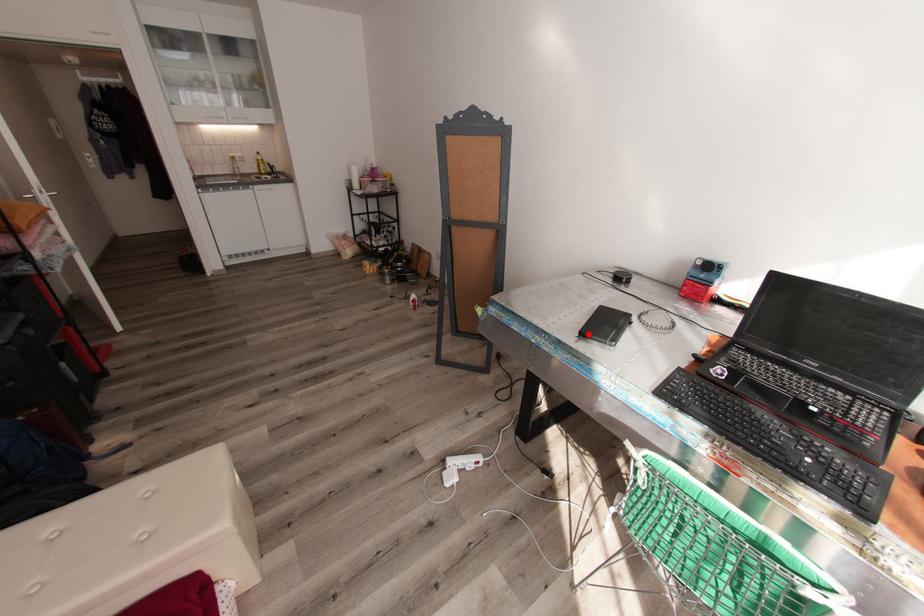
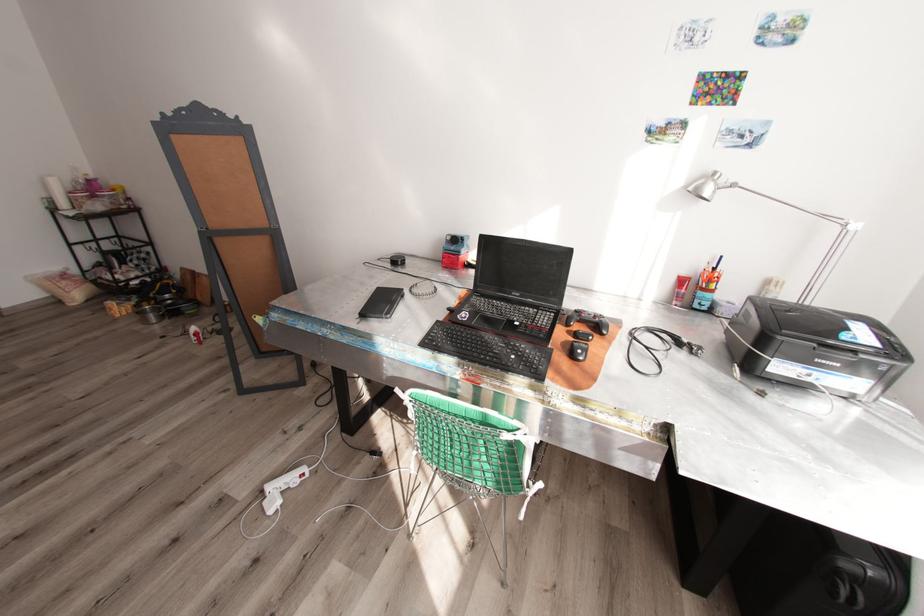
In the second image, find the point that corresponds to the highlighted location in the first image.

(369, 315)